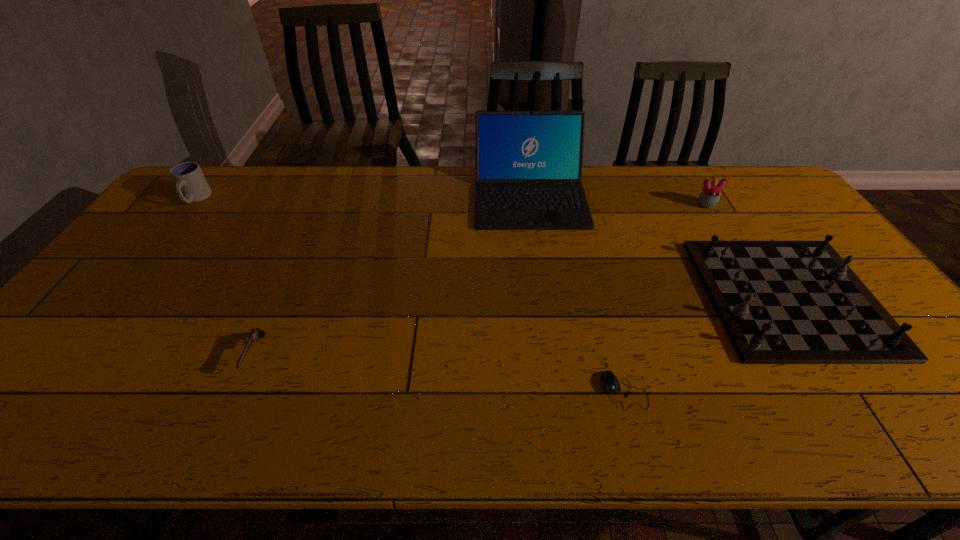
I want to click on free location located 0.240m on the board of the fourth tallest object, so click(619, 297).

Locate an element on the screen. This screenshot has width=960, height=540. vacant space located on the board of the fourth tallest object is located at coordinates (649, 297).

The height and width of the screenshot is (540, 960). I want to click on free space located 0.170m on the board of the fourth tallest object, so click(645, 297).

I want to click on vacant space located on the front-facing side of the second shortest object, so (219, 438).

I want to click on free point located 0.140m on the left of the shortest object, so click(x=541, y=390).

Where is `laptop computer present at the far edge`? The width and height of the screenshot is (960, 540). laptop computer present at the far edge is located at coordinates (529, 164).

At what (x,y) coordinates should I click in order to perform the action: click on cup present at the far edge. Please return your answer as a coordinate pair (x, y). Image resolution: width=960 pixels, height=540 pixels. Looking at the image, I should click on (191, 184).

Image resolution: width=960 pixels, height=540 pixels. Find the location of `cupcake positioned at the far edge`. cupcake positioned at the far edge is located at coordinates (709, 196).

The width and height of the screenshot is (960, 540). Identify the location of object that is at the near edge. (611, 383).

Where is `object that is at the left edge`? object that is at the left edge is located at coordinates (191, 184).